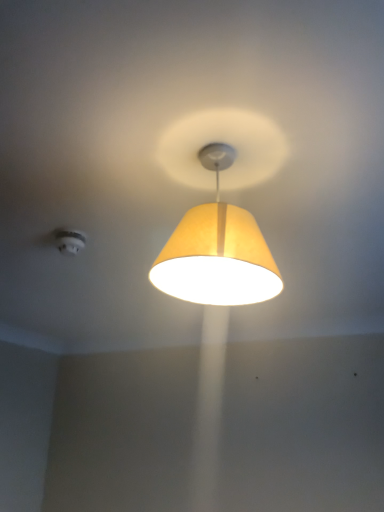
Find the location of a particular element. Image resolution: width=384 pixels, height=512 pixels. matte yellow fabric lampshade at center is located at coordinates (217, 250).

Image resolution: width=384 pixels, height=512 pixels. Describe the element at coordinates (217, 250) in the screenshot. I see `matte yellow fabric lampshade at center` at that location.

Measure the distance between matte yellow fabric lampshade at center and camera.

The depth of matte yellow fabric lampshade at center is 81.25 centimeters.

In order to click on white plastic smoke detector at upper left in this screenshot , I will do `click(69, 241)`.

This screenshot has width=384, height=512. Describe the element at coordinates (69, 241) in the screenshot. I see `white plastic smoke detector at upper left` at that location.

Identify the location of matte yellow fabric lampshade at center. (217, 250).

In the scene shown: Considering the relative positions of matte yellow fabric lampshade at center and white plastic smoke detector at upper left in the image provided, is matte yellow fabric lampshade at center to the right of white plastic smoke detector at upper left from the viewer's perspective?

Yes.

In the image, is matte yellow fabric lampshade at center positioned in front of or behind white plastic smoke detector at upper left?

In the image, matte yellow fabric lampshade at center appears in front of white plastic smoke detector at upper left.

Does point (244, 294) lie in front of point (70, 247)?

Yes.

From the image's perspective, between matte yellow fabric lampshade at center and white plastic smoke detector at upper left, which one is located above?

matte yellow fabric lampshade at center, from the image's perspective.

From a real-world perspective, between matte yellow fabric lampshade at center and white plastic smoke detector at upper left, who is vertically higher?

From a 3D spatial view, white plastic smoke detector at upper left is above.

In the scene shown: Considering the sizes of objects matte yellow fabric lampshade at center and white plastic smoke detector at upper left in the image provided, who is thinner, matte yellow fabric lampshade at center or white plastic smoke detector at upper left?

white plastic smoke detector at upper left.

Considering the relative sizes of matte yellow fabric lampshade at center and white plastic smoke detector at upper left in the image provided, is matte yellow fabric lampshade at center shorter than white plastic smoke detector at upper left?

No.

Between matte yellow fabric lampshade at center and white plastic smoke detector at upper left, which one has larger size?

Bigger between the two is matte yellow fabric lampshade at center.

Is matte yellow fabric lampshade at center not inside white plastic smoke detector at upper left?

Yes.

Are matte yellow fabric lampshade at center and white plastic smoke detector at upper left far apart?

They are positioned close to each other.

Is matte yellow fabric lampshade at center aimed at white plastic smoke detector at upper left?

No, matte yellow fabric lampshade at center is not facing towards white plastic smoke detector at upper left.

Measure the distance between matte yellow fabric lampshade at center and white plastic smoke detector at upper left.

matte yellow fabric lampshade at center is 25.88 inches from white plastic smoke detector at upper left.

The width and height of the screenshot is (384, 512). I want to click on lamp lying above the white plastic smoke detector at upper left (from the image's perspective), so click(x=217, y=250).

Can you confirm if white plastic smoke detector at upper left is positioned to the right of matte yellow fabric lampshade at center?

No.

In the image, is white plastic smoke detector at upper left positioned in front of or behind matte yellow fabric lampshade at center?

Clearly, white plastic smoke detector at upper left is behind matte yellow fabric lampshade at center.

Which point is more forward, (79, 238) or (187, 242)?

The point (187, 242) is closer.

From the image's perspective, does white plastic smoke detector at upper left appear higher than matte yellow fabric lampshade at center?

No, from the image's perspective, white plastic smoke detector at upper left is not on top of matte yellow fabric lampshade at center.

Based on the photo, from a real-world perspective, is white plastic smoke detector at upper left physically located above or below matte yellow fabric lampshade at center?

In terms of real-world spatial position, white plastic smoke detector at upper left is above matte yellow fabric lampshade at center.

Between white plastic smoke detector at upper left and matte yellow fabric lampshade at center, which one has larger width?

matte yellow fabric lampshade at center is wider.

Considering the relative sizes of white plastic smoke detector at upper left and matte yellow fabric lampshade at center in the image provided, is white plastic smoke detector at upper left taller than matte yellow fabric lampshade at center?

No.

Which of these two, white plastic smoke detector at upper left or matte yellow fabric lampshade at center, is smaller?

Smaller between the two is white plastic smoke detector at upper left.

Can we say white plastic smoke detector at upper left lies outside matte yellow fabric lampshade at center?

Yes, white plastic smoke detector at upper left is located beyond the bounds of matte yellow fabric lampshade at center.

Is white plastic smoke detector at upper left with matte yellow fabric lampshade at center?

No, white plastic smoke detector at upper left is not making contact with matte yellow fabric lampshade at center.

Is white plastic smoke detector at upper left positioned with its back to matte yellow fabric lampshade at center?

No, white plastic smoke detector at upper left's orientation is not away from matte yellow fabric lampshade at center.

How different are the orientations of white plastic smoke detector at upper left and matte yellow fabric lampshade at center in degrees?

white plastic smoke detector at upper left and matte yellow fabric lampshade at center are facing 172 degrees away from each other.

The width and height of the screenshot is (384, 512). In order to click on lamp above the white plastic smoke detector at upper left (from the image's perspective) in this screenshot , I will do `click(217, 250)`.

In the image, there is a white plastic smoke detector at upper left. Where is `lamp above it (from the image's perspective)`? The height and width of the screenshot is (512, 384). lamp above it (from the image's perspective) is located at coordinates (217, 250).

Find the location of a particular element. This screenshot has width=384, height=512. lighting below the matte yellow fabric lampshade at center (from the image's perspective) is located at coordinates (69, 241).